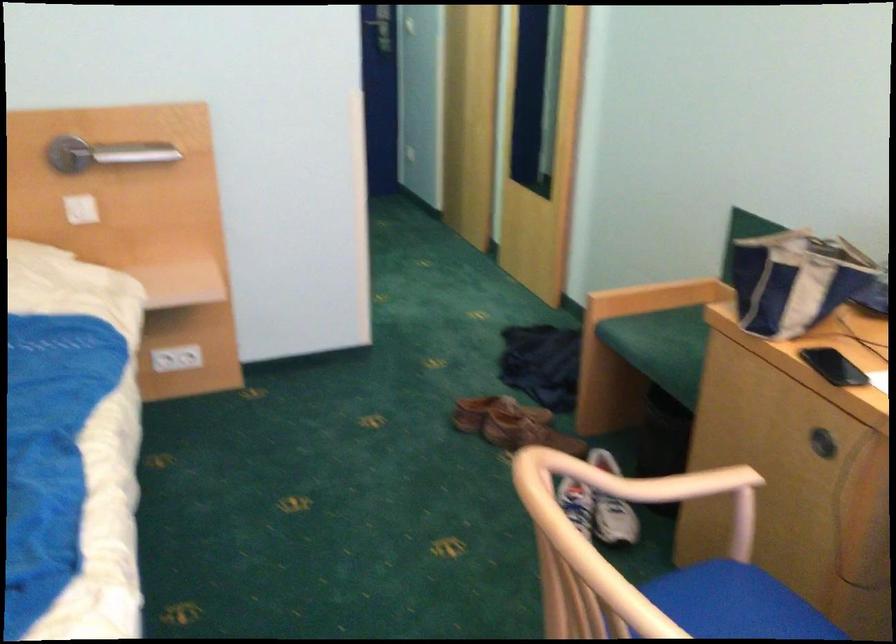
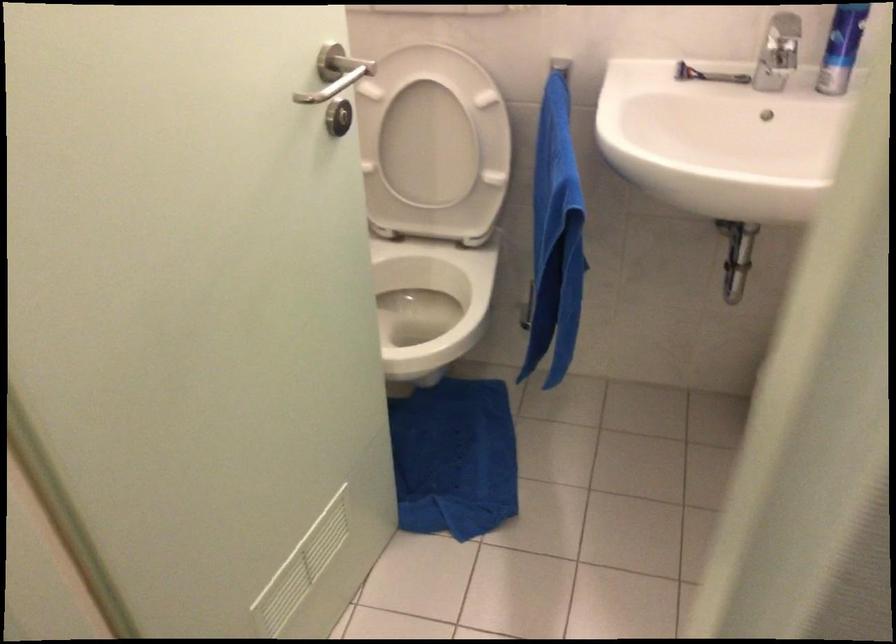
Question: I am providing you with two images of the same scene from different viewpoints. Which of the following objects are not visible in image2?

Choices:
 (A) metal wire basket
 (B) metal door handle
 (C) razor
 (D) white power socket

Answer: (D)